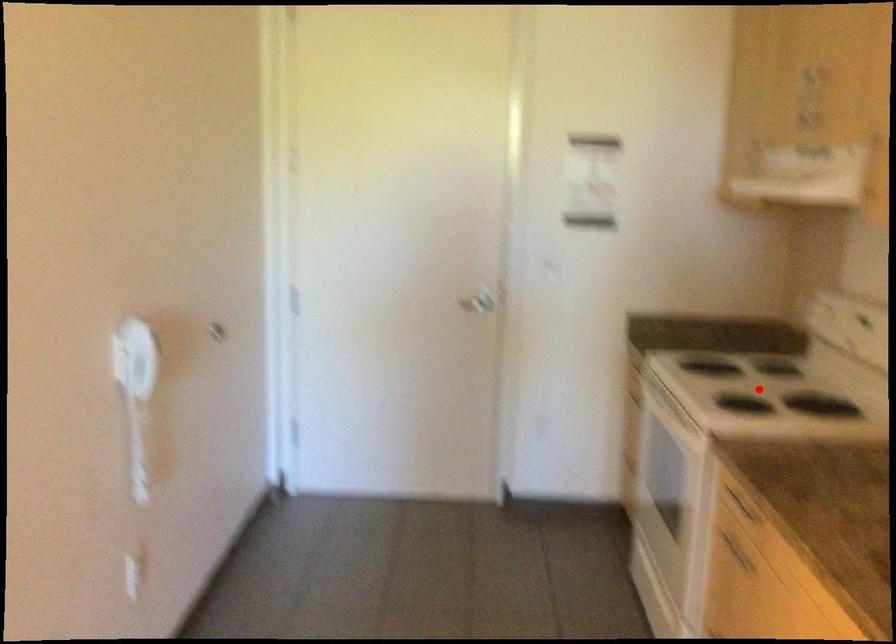
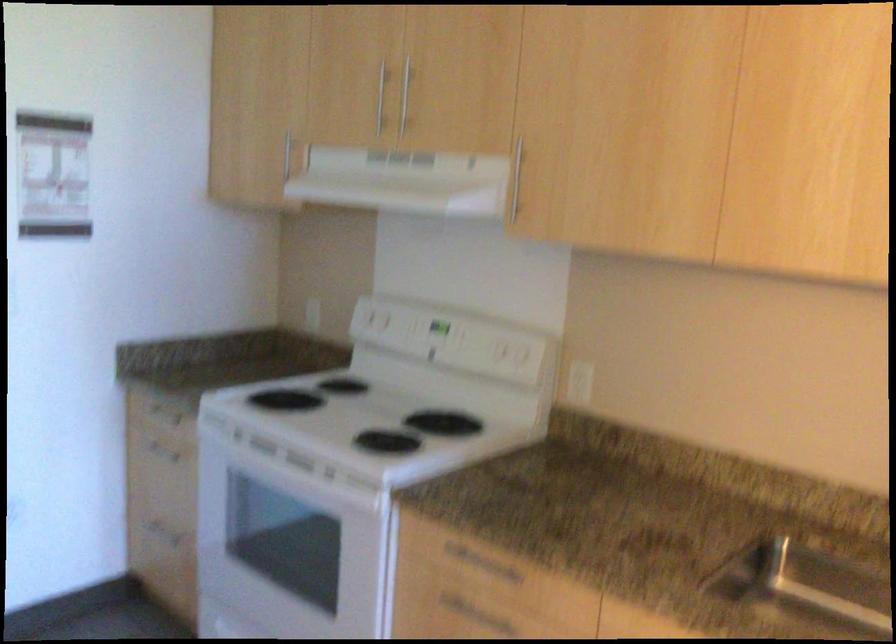
Question: I am providing you with two images of the same scene from different viewpoints. In image1, a red point is highlighted. Considering the same 3D point in image2, which of the following is correct?

Choices:
 (A) It is closer
 (B) It is farther

Answer: (A)